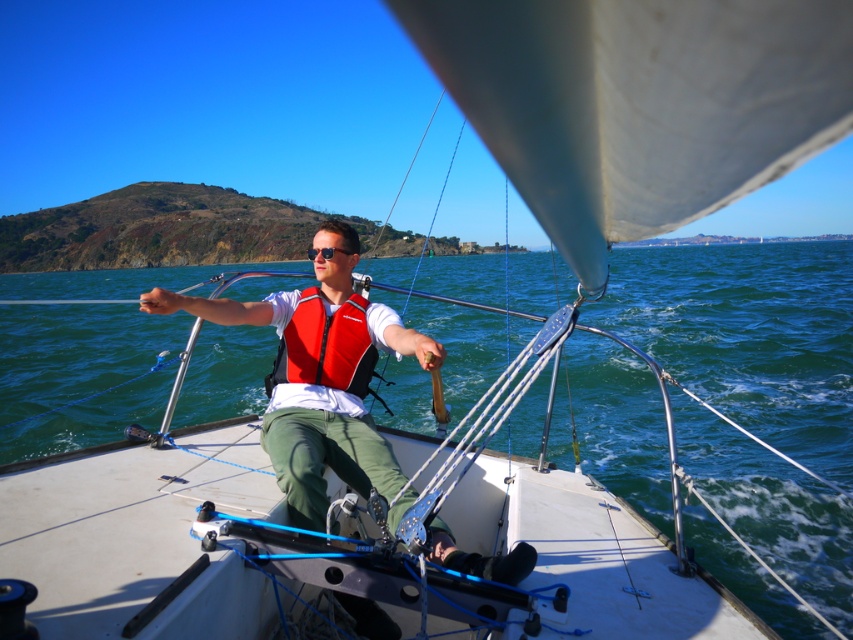
You are a sailor on the deck of a sailboat. You notice a red nylon life jacket at center and sunglasses at center. Which object is positioned to the right side?

The red nylon life jacket at center is to the right of sunglasses at center.

You are a sailor on the boat and need to quickly grab either the matte red life vest at center or the red nylon life jacket at center. Which one is closer to your right hand?

The matte red life vest at center is to the right of the red nylon life jacket at center, so it is closer to your right hand.

Looking at this image, you are a safety inspector on the boat and need to ensure all life vests are properly sized. You notice two life vests at the center of the deck. Which one is taller, the matte red life vest at center or the red nylon life jacket at center?

The matte red life vest at center is taller than the red nylon life jacket at center according to the description.